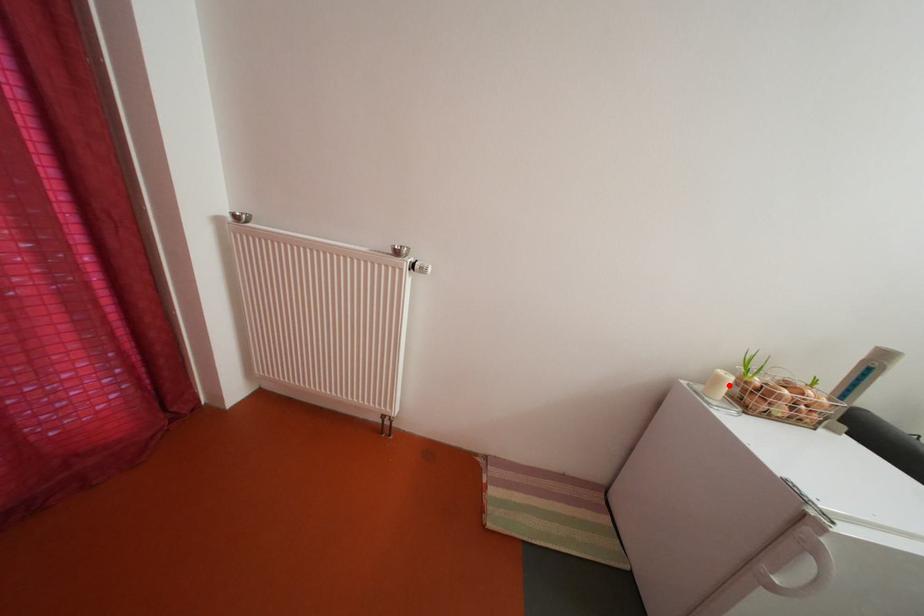
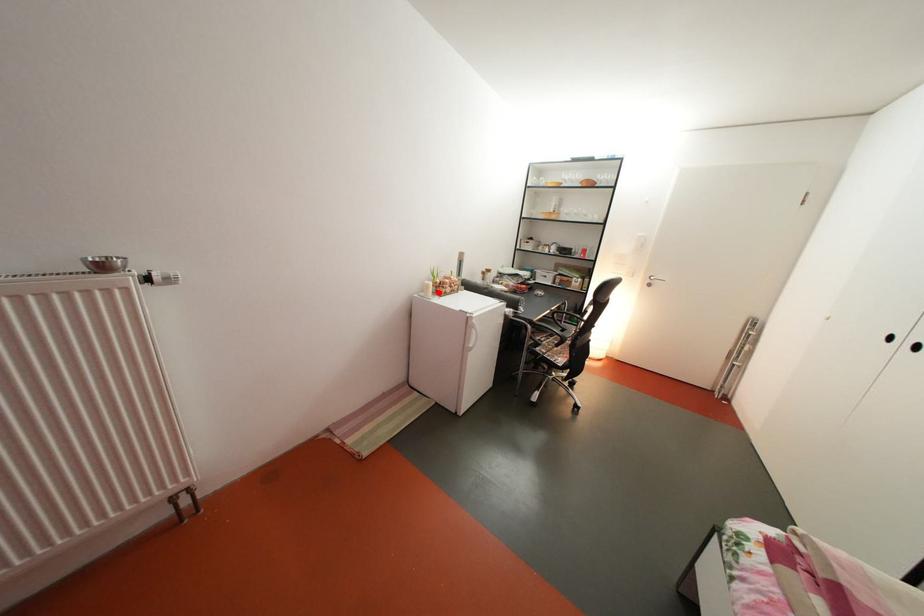
I am providing you with two images of the same scene from different viewpoints. A red point is marked on the first image and another point is marked on the second image. Are the points marked in image1 and image2 representing the same 3D position?

Yes